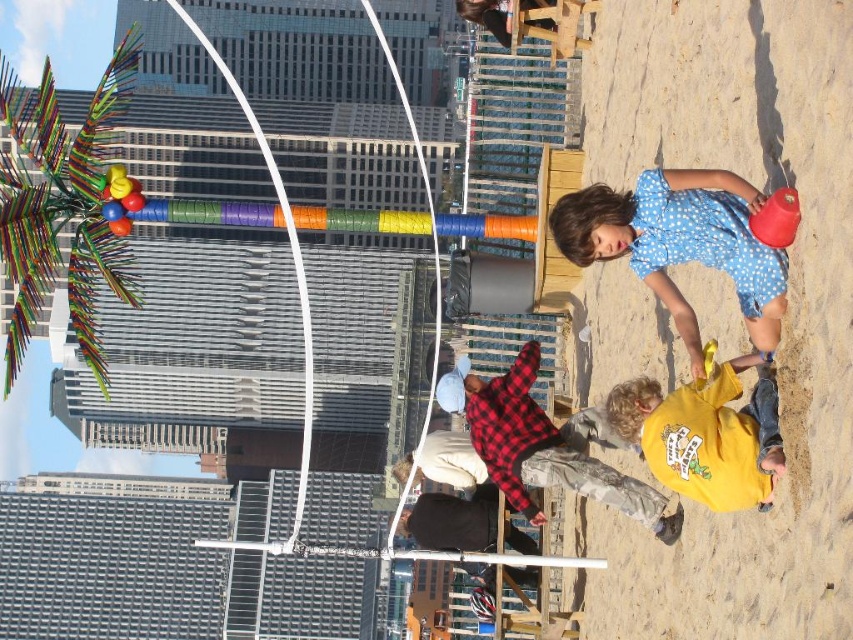
Can you confirm if fine-grained sand at lower right is bigger than yellow cotton shirt at lower center?

Yes, fine-grained sand at lower right is bigger than yellow cotton shirt at lower center.

Which is more to the right, fine-grained sand at lower right or yellow cotton shirt at lower center?

Positioned to the right is fine-grained sand at lower right.

Is point (613, 100) positioned in front of point (648, 460)?

No, it is not.

Find the location of a particular element. fine-grained sand at lower right is located at coordinates (784, 316).

Between multicolored plastic palm tree at left and yellow cotton shirt at lower center, which one has less height?

Standing shorter between the two is yellow cotton shirt at lower center.

Who is higher up, multicolored plastic palm tree at left or yellow cotton shirt at lower center?

Positioned higher is multicolored plastic palm tree at left.

Describe the element at coordinates (61, 204) in the screenshot. The image size is (853, 640). I see `multicolored plastic palm tree at left` at that location.

In order to click on multicolored plastic palm tree at left in this screenshot , I will do `click(61, 204)`.

Is point (773, 307) closer to viewer compared to point (633, 406)?

That is True.

Between point (569, 218) and point (618, 432), which one is positioned in front?

Point (569, 218) is in front.

Is point (671, 202) farther from viewer compared to point (715, 392)?

Yes.

Locate an element on the screen. This screenshot has height=640, width=853. blue dotted romper at lower right is located at coordinates (680, 243).